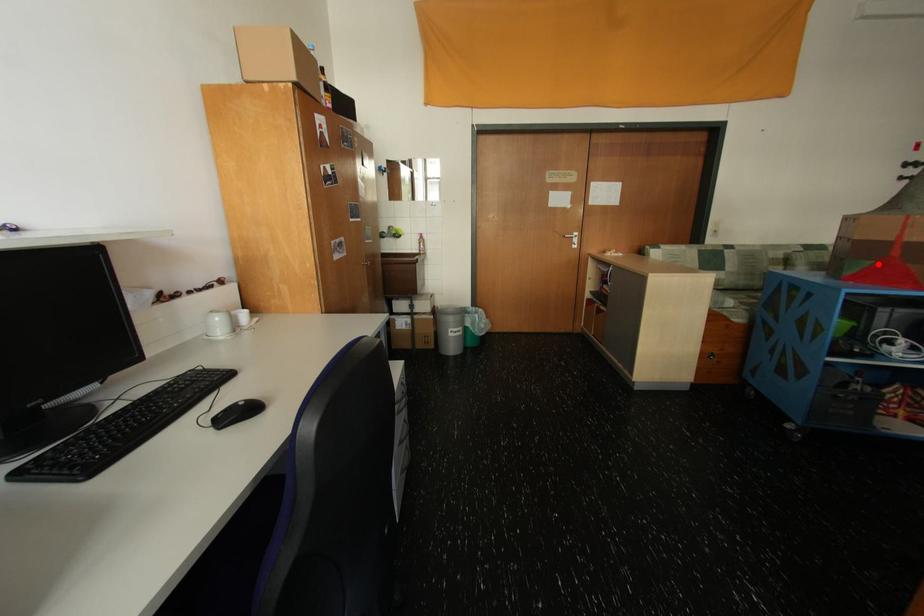
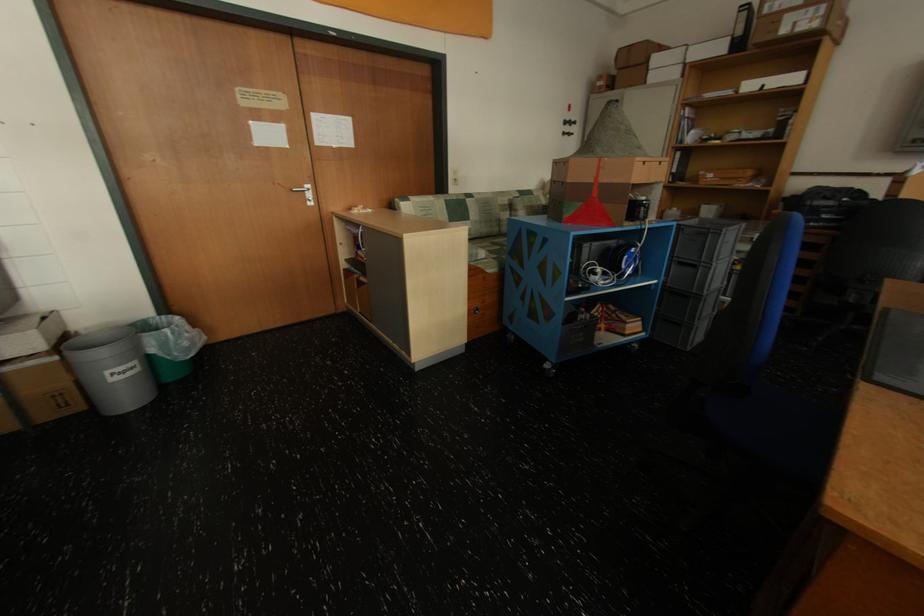
Question: I am providing you with two images of the same scene from different viewpoints. Given a red point in image1, look at the same physical point in image2. Is it:

Choices:
 (A) Closer to the viewpoint
 (B) Farther from the viewpoint

Answer: (A)